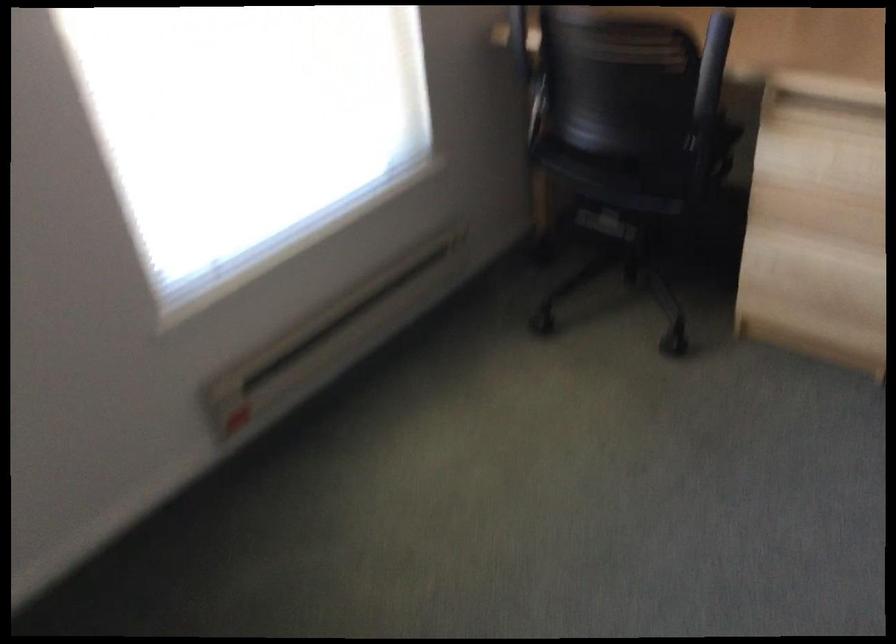
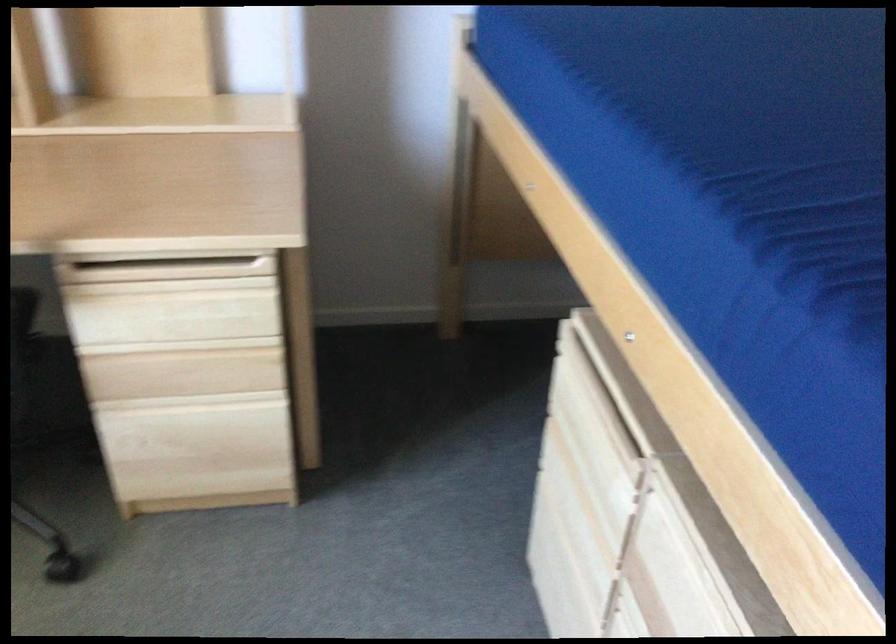
The point at (822, 243) is marked in the first image. Where is the corresponding point in the second image?

(192, 401)